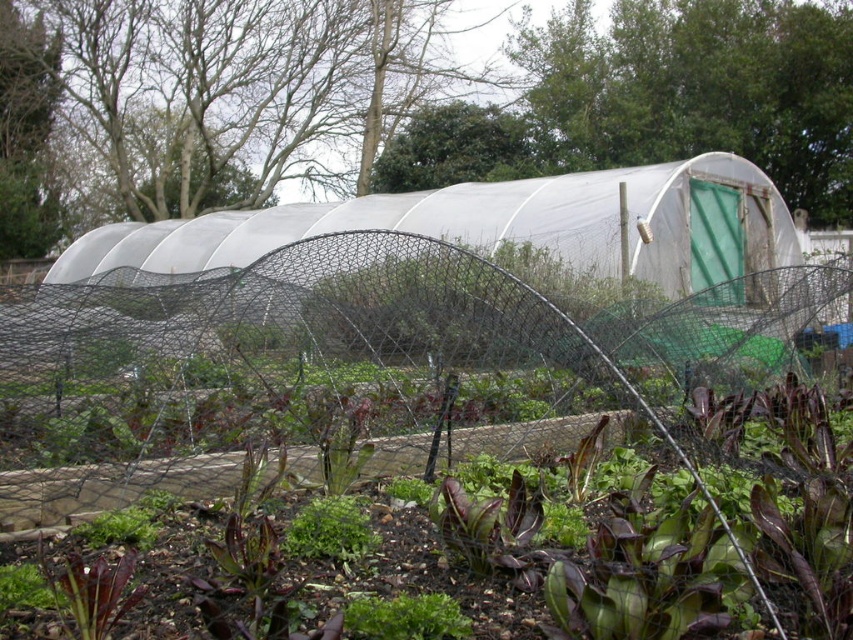
You are a gardener planning to install a new plant bed in the garden. The garden bed must be placed in an area that is not currently occupied by the green mesh netting at center. Based on the scene, where should you position the new plant bed?

The green mesh netting at center is located at point (355, 372). To avoid placing the new plant bed where it is, position it in an area not overlapping with that coordinate.

In the garden scene, you see a green mesh netting at center and a green leafy plant at center. Which object is positioned to the right of the other?

The green mesh netting at center is to the right of the green leafy plant at center.

You are a gardener who wants to water the green leafy plant at center. However, there is a green mesh netting at center in the way. Can you water the plant without moving the netting?

The green mesh netting at center is above the green leafy plant at center, so you can water the plant without moving the netting because the netting is positioned above it and allows water to pass through.